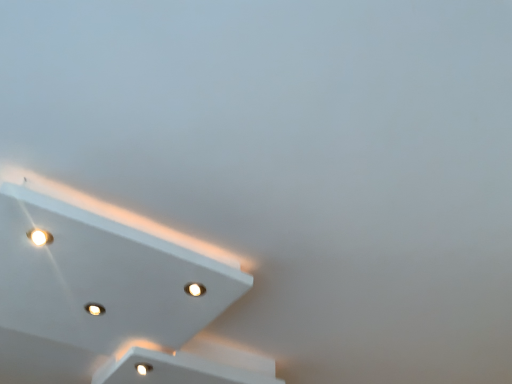
Question: Does white glossy light fixture at upper left appear on the right side of white glossy light at bottom left, the 1th dot in the right-to-left sequence?

Choices:
 (A) yes
 (B) no

Answer: (B)

Question: Does white glossy light fixture at upper left lie in front of white glossy light at bottom left, the 2th dot when ordered from front to back?

Choices:
 (A) yes
 (B) no

Answer: (A)

Question: Considering the relative sizes of white glossy light fixture at upper left and white glossy light at bottom left, the 2th dot in the left-to-right sequence, in the image provided, is white glossy light fixture at upper left thinner than white glossy light at bottom left, the 2th dot in the left-to-right sequence,?

Choices:
 (A) no
 (B) yes

Answer: (A)

Question: Considering the relative sizes of white glossy light fixture at upper left and white glossy light at bottom left, arranged as the first dot when viewed from the back, in the image provided, is white glossy light fixture at upper left wider than white glossy light at bottom left, arranged as the first dot when viewed from the back,?

Choices:
 (A) no
 (B) yes

Answer: (B)

Question: Is white glossy light fixture at upper left to the left of white glossy light at bottom left, the 2th dot in the left-to-right sequence, from the viewer's perspective?

Choices:
 (A) yes
 (B) no

Answer: (A)

Question: Is white glossy light fixture at upper left completely or partially outside of white glossy light at bottom left, the 1th dot in the right-to-left sequence?

Choices:
 (A) no
 (B) yes

Answer: (B)

Question: Is white glossy light at bottom left, the 2th dot viewed from the top, to the left of white glossy light fixture at upper left from the viewer's perspective?

Choices:
 (A) yes
 (B) no

Answer: (B)

Question: From the image's perspective, is white glossy light at bottom left, the 1th dot in the right-to-left sequence, above white glossy light fixture at upper left?

Choices:
 (A) yes
 (B) no

Answer: (B)

Question: Is white glossy light at bottom left, the 1th dot in the right-to-left sequence, oriented towards white glossy light fixture at upper left?

Choices:
 (A) yes
 (B) no

Answer: (B)

Question: Is white glossy light at bottom left, the 1th dot in the right-to-left sequence, in front of white glossy light fixture at upper left?

Choices:
 (A) no
 (B) yes

Answer: (A)

Question: Is white glossy light fixture at upper left at the back of white glossy light at bottom left, arranged as the first dot when viewed from the back?

Choices:
 (A) no
 (B) yes

Answer: (A)

Question: Is white glossy light at bottom left, the 2th dot in the left-to-right sequence, surrounding white glossy light fixture at upper left?

Choices:
 (A) yes
 (B) no

Answer: (B)

Question: Considering the relative sizes of matte white light at upper left, acting as the first dot starting from the left, and white glossy light fixture at upper left in the image provided, is matte white light at upper left, acting as the first dot starting from the left, taller than white glossy light fixture at upper left?

Choices:
 (A) no
 (B) yes

Answer: (A)